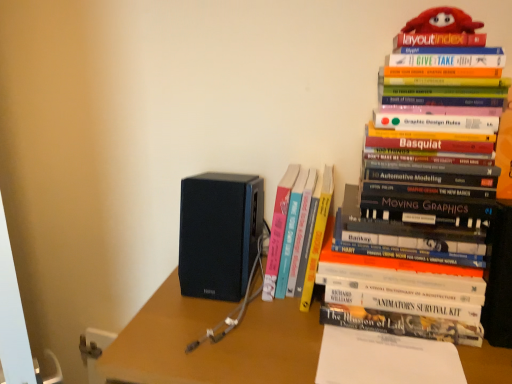
Find the location of a particular element. The height and width of the screenshot is (384, 512). free point to the left of white paper at center is located at coordinates (266, 338).